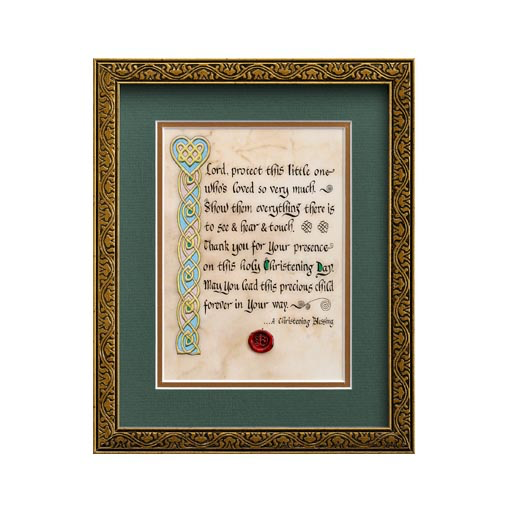
I want to click on frame corner, so click(x=95, y=451), click(x=414, y=453), click(x=412, y=62), click(x=97, y=61).